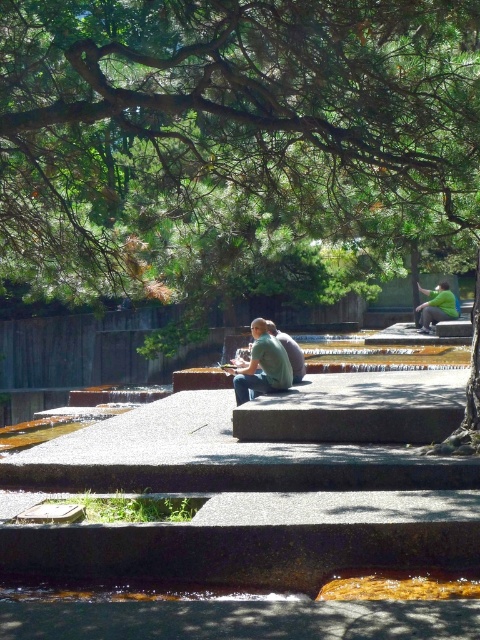
Question: Which of the following is the farthest from the observer?

Choices:
 (A) green matte shirt at center
 (B) green cotton shirt at center
 (C) green leafy tree at upper center

Answer: (A)

Question: Can you confirm if green leafy tree at upper center is positioned to the right of green cotton shirt at center?

Choices:
 (A) yes
 (B) no

Answer: (A)

Question: Estimate the real-world distances between objects in this image. Which object is farther from the green cotton shirt at center?

Choices:
 (A) green matte shirt at center
 (B) green leafy tree at upper center

Answer: (A)

Question: Is green leafy tree at upper center positioned before green cotton shirt at center?

Choices:
 (A) no
 (B) yes

Answer: (B)

Question: Can you confirm if green leafy tree at upper center is positioned to the right of green matte shirt at center?

Choices:
 (A) yes
 (B) no

Answer: (B)

Question: Which point is closer to the camera?

Choices:
 (A) (264, 332)
 (B) (420, 308)
 (C) (13, 195)

Answer: (C)